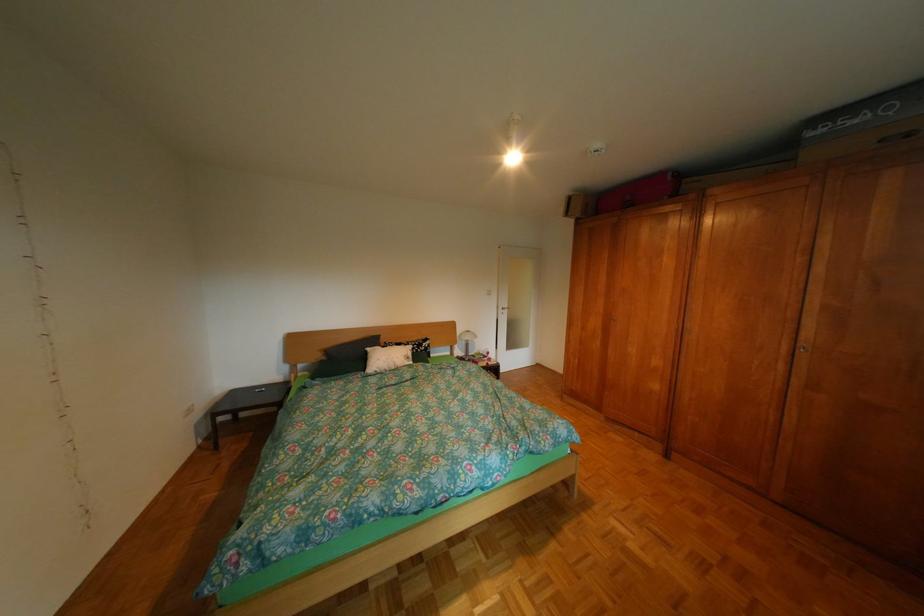
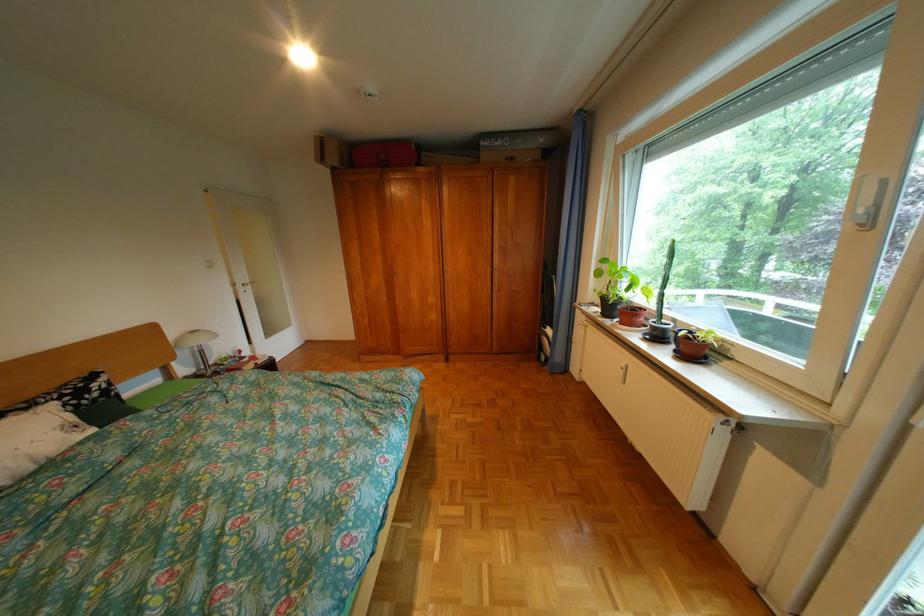
Where in the second image is the point corresponding to the point at 824,135 from the first image?

(497, 145)